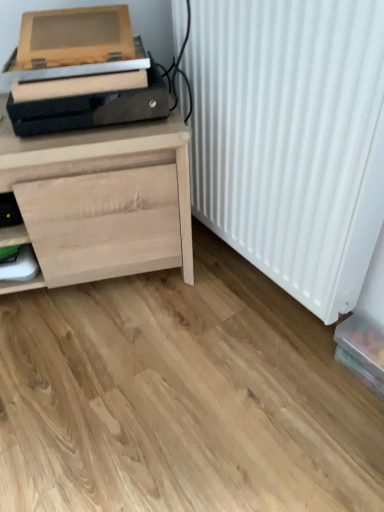
Question: From a real-world perspective, is white matte radiator at right over translucent plastic box at lower right?

Choices:
 (A) no
 (B) yes

Answer: (B)

Question: Is white matte radiator at right in contact with translucent plastic box at lower right?

Choices:
 (A) yes
 (B) no

Answer: (B)

Question: Does white matte radiator at right have a lesser height compared to translucent plastic box at lower right?

Choices:
 (A) no
 (B) yes

Answer: (A)

Question: Is white matte radiator at right to the left of translucent plastic box at lower right from the viewer's perspective?

Choices:
 (A) yes
 (B) no

Answer: (A)

Question: Is white matte radiator at right facing away from translucent plastic box at lower right?

Choices:
 (A) no
 (B) yes

Answer: (A)

Question: Considering the positions of natural wood chest of drawers at left and translucent plastic box at lower right in the image, is natural wood chest of drawers at left wider or thinner than translucent plastic box at lower right?

Choices:
 (A) wide
 (B) thin

Answer: (A)

Question: Is natural wood chest of drawers at left taller or shorter than translucent plastic box at lower right?

Choices:
 (A) tall
 (B) short

Answer: (A)

Question: Visually, is natural wood chest of drawers at left positioned to the left or to the right of translucent plastic box at lower right?

Choices:
 (A) left
 (B) right

Answer: (A)

Question: Looking at the image, does natural wood chest of drawers at left seem bigger or smaller compared to translucent plastic box at lower right?

Choices:
 (A) small
 (B) big

Answer: (B)

Question: Which is correct: translucent plastic box at lower right is inside white matte radiator at right, or outside of it?

Choices:
 (A) outside
 (B) inside

Answer: (A)

Question: Looking at the image, does translucent plastic box at lower right seem bigger or smaller compared to white matte radiator at right?

Choices:
 (A) small
 (B) big

Answer: (A)

Question: Considering their positions, is translucent plastic box at lower right located in front of or behind white matte radiator at right?

Choices:
 (A) behind
 (B) front

Answer: (A)

Question: From a real-world perspective, is translucent plastic box at lower right physically located above or below white matte radiator at right?

Choices:
 (A) below
 (B) above

Answer: (A)

Question: In terms of size, does natural wood chest of drawers at left appear bigger or smaller than white matte radiator at right?

Choices:
 (A) big
 (B) small

Answer: (A)

Question: Is point (74, 264) closer or farther from the camera than point (377, 83)?

Choices:
 (A) closer
 (B) farther

Answer: (B)